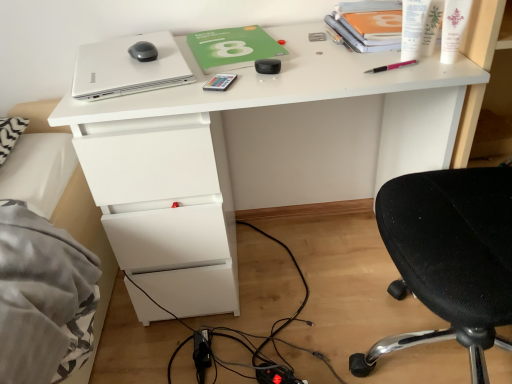
This screenshot has width=512, height=384. What are the coordinates of `free space between green matte notebook at center and white glossy cream at upper right` in the screenshot? It's located at (330, 57).